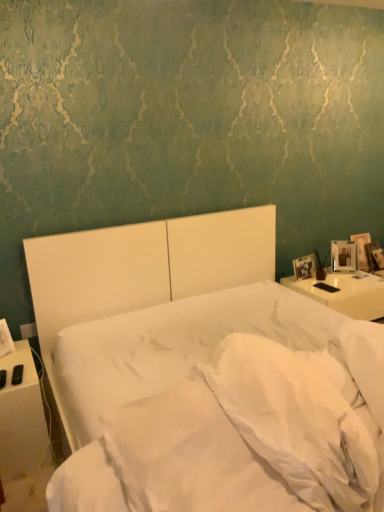
Question: Is white matte bed at center wider than white soft pillow at center, marked as the first pillow in a left-to-right arrangement?

Choices:
 (A) no
 (B) yes

Answer: (B)

Question: Can you confirm if white matte bed at center is positioned to the left of white soft pillow at center, marked as the 2th pillow in a right-to-left arrangement?

Choices:
 (A) no
 (B) yes

Answer: (A)

Question: From the image's perspective, is white matte bed at center located above white soft pillow at center, marked as the 2th pillow in a right-to-left arrangement?

Choices:
 (A) yes
 (B) no

Answer: (B)

Question: From a real-world perspective, is white matte bed at center beneath white soft pillow at center, marked as the first pillow in a left-to-right arrangement?

Choices:
 (A) yes
 (B) no

Answer: (A)

Question: Is white matte bed at center located outside white soft pillow at center, marked as the 2th pillow in a right-to-left arrangement?

Choices:
 (A) yes
 (B) no

Answer: (A)

Question: Considering the positions of white glossy nightstand at right, which ranks as the first nightstand in right-to-left order, and white plastic remote at left, the second nightstand viewed from the back, in the image, is white glossy nightstand at right, which ranks as the first nightstand in right-to-left order, wider or thinner than white plastic remote at left, the second nightstand viewed from the back,?

Choices:
 (A) thin
 (B) wide

Answer: (B)

Question: From the image's perspective, is white glossy nightstand at right, marked as the 2th nightstand in a front-to-back arrangement, positioned above or below white plastic remote at left, the second nightstand viewed from the back?

Choices:
 (A) below
 (B) above

Answer: (B)

Question: Would you say white glossy nightstand at right, which ranks as the first nightstand in right-to-left order, is to the left or to the right of white plastic remote at left, the first nightstand from the left, in the picture?

Choices:
 (A) right
 (B) left

Answer: (A)

Question: In terms of size, does white glossy nightstand at right, which is the 1th nightstand in back-to-front order, appear bigger or smaller than white plastic remote at left, the second nightstand viewed from the back?

Choices:
 (A) big
 (B) small

Answer: (A)

Question: From the image's perspective, is white soft pillow at lower right, arranged as the second pillow when viewed from the left, located above or below white matte bed at center?

Choices:
 (A) above
 (B) below

Answer: (A)

Question: Is white soft pillow at lower right, which is the first pillow in right-to-left order, wider or thinner than white matte bed at center?

Choices:
 (A) wide
 (B) thin

Answer: (B)

Question: Considering the positions of point (370, 335) and point (241, 292), is point (370, 335) closer or farther from the camera than point (241, 292)?

Choices:
 (A) closer
 (B) farther

Answer: (A)

Question: Considering the positions of white soft pillow at lower right, which is the first pillow in right-to-left order, and white matte bed at center in the image, is white soft pillow at lower right, which is the first pillow in right-to-left order, taller or shorter than white matte bed at center?

Choices:
 (A) tall
 (B) short

Answer: (B)

Question: Is white matte bed at center wider or thinner than white soft pillow at center, marked as the 2th pillow in a right-to-left arrangement?

Choices:
 (A) wide
 (B) thin

Answer: (A)

Question: From a real-world perspective, is white matte bed at center above or below white soft pillow at center, marked as the 2th pillow in a right-to-left arrangement?

Choices:
 (A) below
 (B) above

Answer: (A)